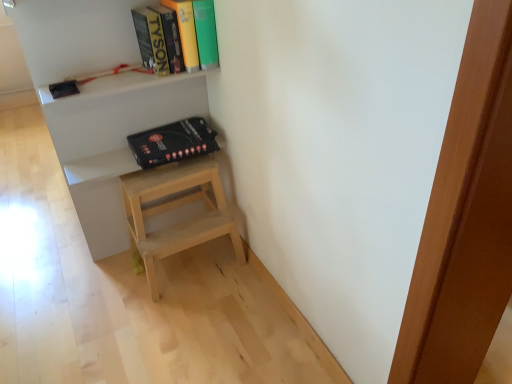
Question: From a real-world perspective, is white matte shelf at upper center physically located above or below black matte box at upper center?

Choices:
 (A) below
 (B) above

Answer: (B)

Question: In terms of width, does white matte shelf at upper center look wider or thinner when compared to black matte box at upper center?

Choices:
 (A) wide
 (B) thin

Answer: (B)

Question: Which object is the closest to the black matte box at upper center?

Choices:
 (A) white matte shelf at upper center
 (B) hardcover book at upper center

Answer: (A)

Question: Which object is the closest to the white matte shelf at upper center?

Choices:
 (A) hardcover book at upper center
 (B) black matte box at upper center

Answer: (B)